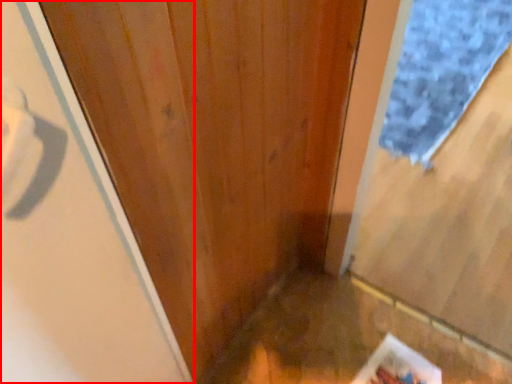
Question: From the image's perspective, what is the correct spatial relationship of screen door (annotated by the red box) in relation to doormat?

Choices:
 (A) above
 (B) below

Answer: (B)